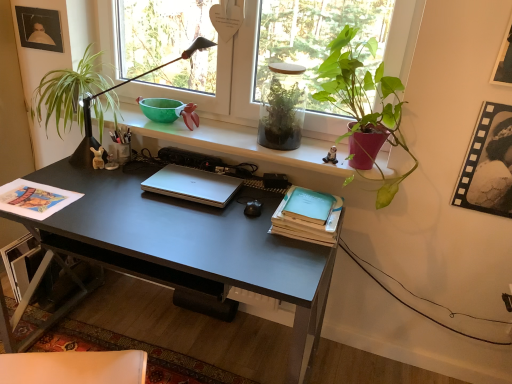
Question: Is light blue matte paper at center right, the second paperback book when ordered from top to bottom, outside matte black picture frame at upper left, which is the 1th picture frame from left to right?

Choices:
 (A) yes
 (B) no

Answer: (A)

Question: Does light blue matte paper at center right, arranged as the 1th paperback book when ordered from the bottom, have a greater height compared to matte black picture frame at upper left, the second picture frame positioned from the right?

Choices:
 (A) no
 (B) yes

Answer: (A)

Question: Is light blue matte paper at center right, the second paperback book when ordered from top to bottom, directly adjacent to matte black picture frame at upper left, which is the 1th picture frame from left to right?

Choices:
 (A) no
 (B) yes

Answer: (A)

Question: From the image's perspective, does light blue matte paper at center right, arranged as the 1th paperback book when ordered from the bottom, appear lower than matte black picture frame at upper left, placed as the 2th picture frame when sorted from front to back?

Choices:
 (A) yes
 (B) no

Answer: (A)

Question: From a real-world perspective, is light blue matte paper at center right, arranged as the 1th paperback book when ordered from the bottom, physically below matte black picture frame at upper left, placed as the 2th picture frame when sorted from front to back?

Choices:
 (A) no
 (B) yes

Answer: (B)

Question: Is the depth of light blue matte paper at center right, the second paperback book when ordered from top to bottom, greater than that of matte black picture frame at upper left, which is the 1th picture frame from left to right?

Choices:
 (A) no
 (B) yes

Answer: (A)

Question: From the image's perspective, is silver metallic laptop at center located beneath transparent glass window at upper center?

Choices:
 (A) yes
 (B) no

Answer: (A)

Question: Does silver metallic laptop at center turn towards transparent glass window at upper center?

Choices:
 (A) no
 (B) yes

Answer: (A)

Question: From a real-world perspective, is silver metallic laptop at center physically below transparent glass window at upper center?

Choices:
 (A) yes
 (B) no

Answer: (A)

Question: Considering the relative positions of silver metallic laptop at center and transparent glass window at upper center in the image provided, is silver metallic laptop at center in front of transparent glass window at upper center?

Choices:
 (A) no
 (B) yes

Answer: (A)

Question: Considering the relative positions of silver metallic laptop at center and transparent glass window at upper center in the image provided, is silver metallic laptop at center to the right of transparent glass window at upper center from the viewer's perspective?

Choices:
 (A) yes
 (B) no

Answer: (B)

Question: Is silver metallic laptop at center far away from transparent glass window at upper center?

Choices:
 (A) no
 (B) yes

Answer: (A)

Question: Can you confirm if matte black desk at center is taller than translucent glass terrarium at center, which is counted as the 2th houseplant, starting from the right?

Choices:
 (A) yes
 (B) no

Answer: (A)